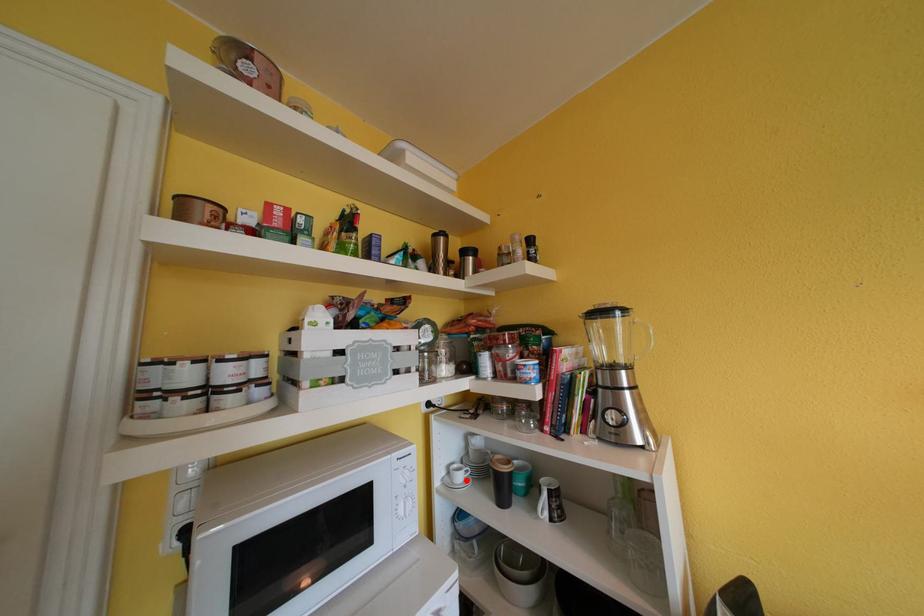
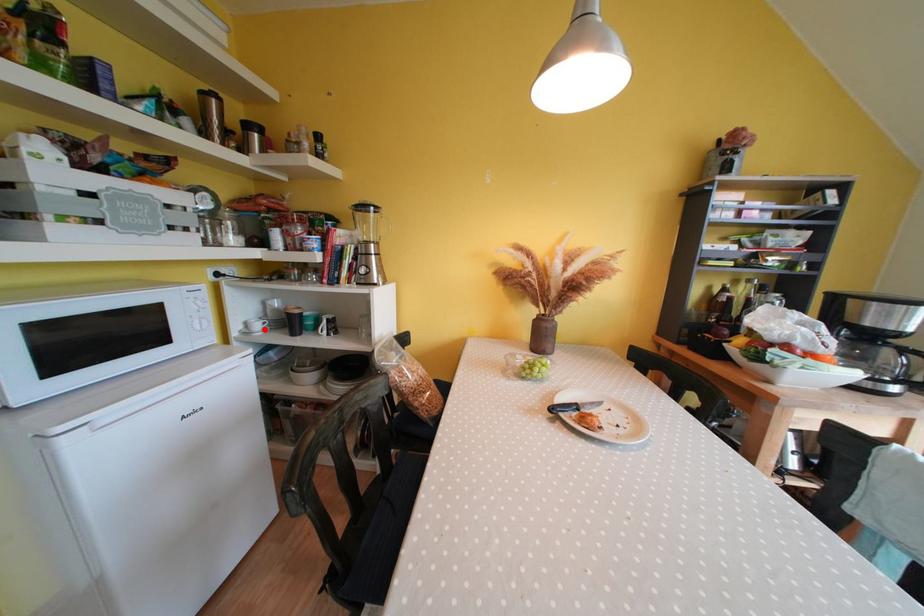
I am providing you with two images of the same scene from different viewpoints. A red point is marked on the first image and another point is marked on the second image. Is the marked point in image1 the same physical position as the marked point in image2?

Yes